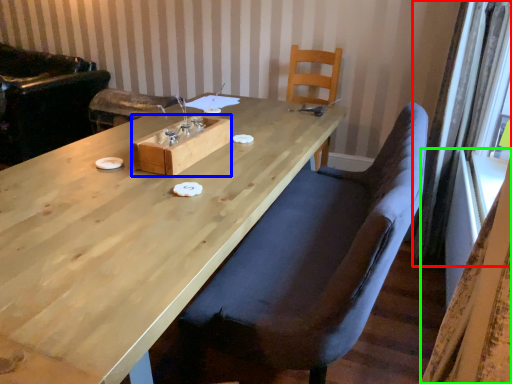
Question: Which is farther away from curtain (highlighted by a red box)? wood (highlighted by a blue box) or curtain (highlighted by a green box)?

Choices:
 (A) wood
 (B) curtain

Answer: (B)